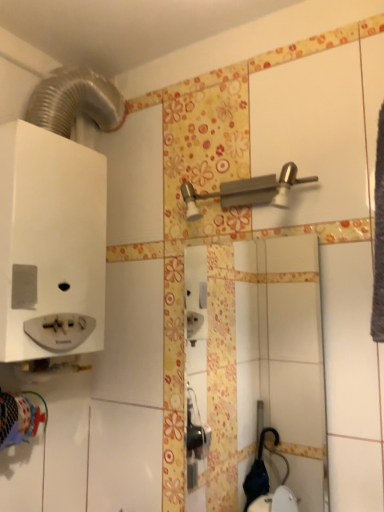
Question: Is white glossy mirror at center to the left or to the right of satin nickel shower at upper center in the image?

Choices:
 (A) right
 (B) left

Answer: (A)

Question: Is white glossy mirror at center in front of or behind satin nickel shower at upper center in the image?

Choices:
 (A) behind
 (B) front

Answer: (A)

Question: Is white glossy mirror at center taller or shorter than satin nickel shower at upper center?

Choices:
 (A) short
 (B) tall

Answer: (B)

Question: Considering the positions of satin nickel shower at upper center and white glossy mirror at center in the image, is satin nickel shower at upper center bigger or smaller than white glossy mirror at center?

Choices:
 (A) small
 (B) big

Answer: (B)

Question: Is satin nickel shower at upper center wider or thinner than white glossy mirror at center?

Choices:
 (A) wide
 (B) thin

Answer: (A)

Question: Is satin nickel shower at upper center in front of or behind white glossy mirror at center in the image?

Choices:
 (A) front
 (B) behind

Answer: (A)

Question: Does point [x=185, y=188] appear closer or farther from the camera than point [x=296, y=279]?

Choices:
 (A) farther
 (B) closer

Answer: (B)